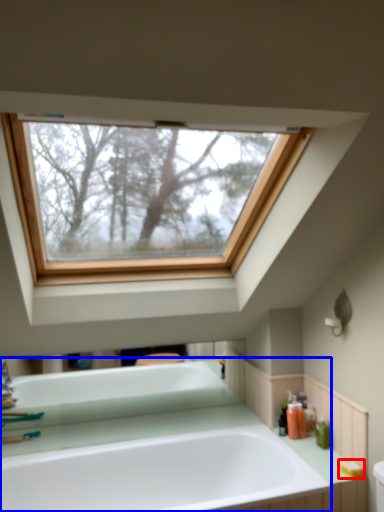
Question: Among these objects, which one is nearest to the camera, soap (highlighted by a red box) or bathtub (highlighted by a blue box)?

Choices:
 (A) soap
 (B) bathtub

Answer: (B)